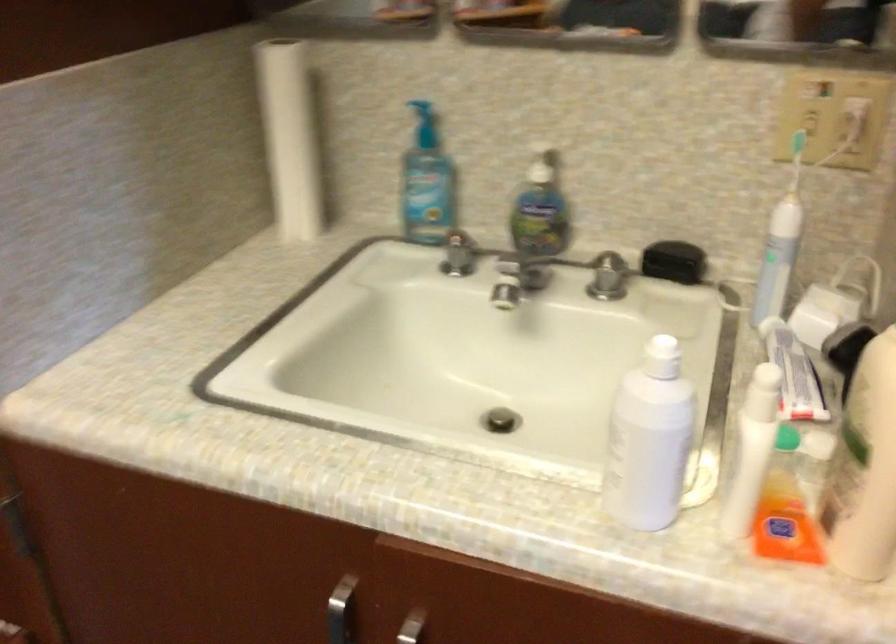
The height and width of the screenshot is (644, 896). In order to click on white bottle cap in this screenshot , I will do `click(661, 357)`.